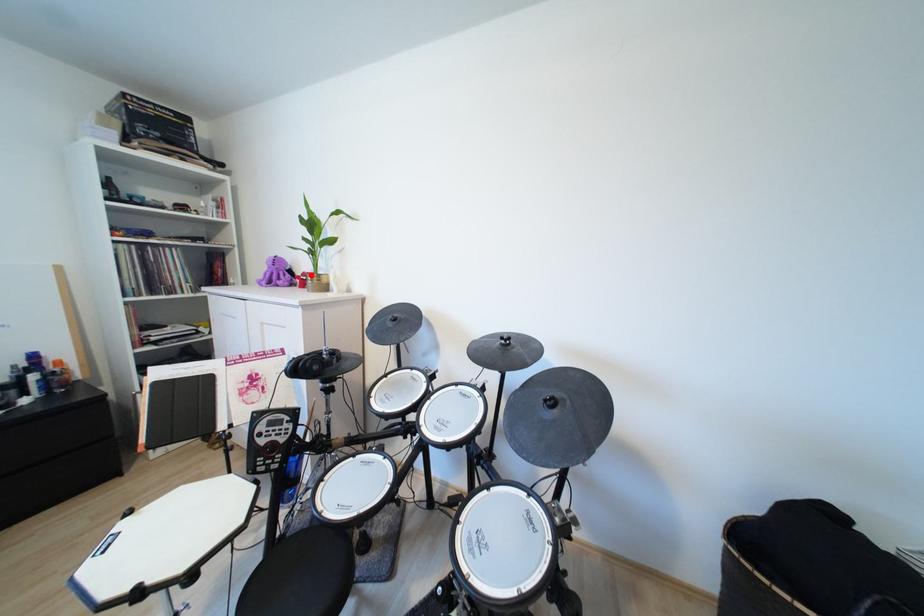
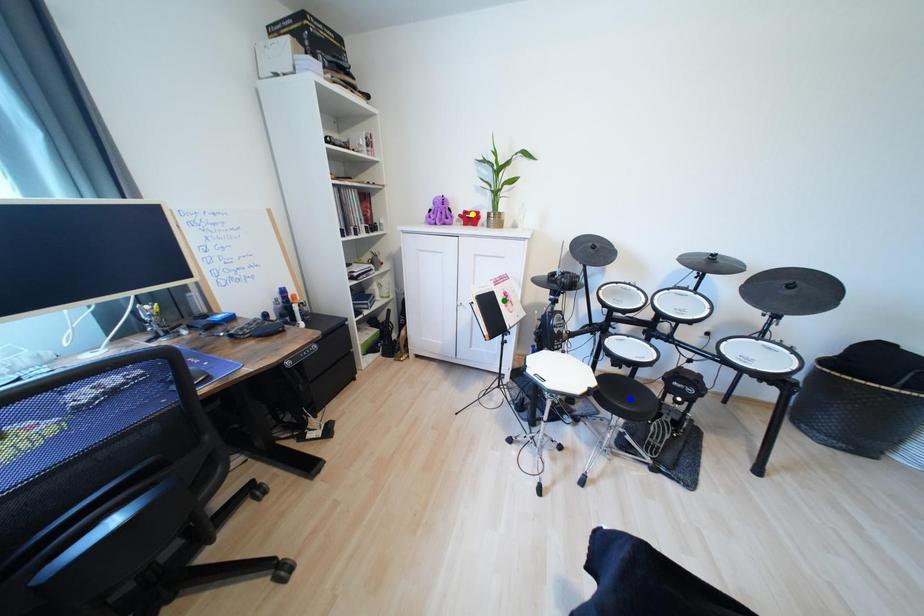
Question: I am providing you with two images of the same scene from different viewpoints. A red point is marked on the first image. You are given multiple points on the second image. In image 2, which mark is for the same physical point as the one in image 1?

Choices:
 (A) blue point
 (B) yellow point
 (C) green point

Answer: (B)